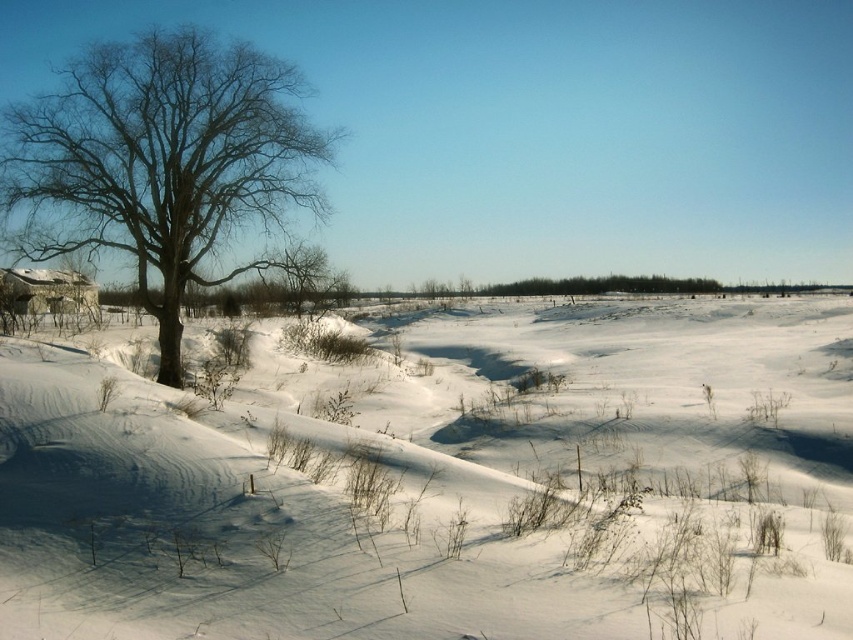
You are an observer looking at the winter landscape. You notice the white fluffy snow at center and the bare branches at left. Which of these two objects is positioned more to the east if the sun is setting in the west and casting shadows towards the east?

The bare branches at left cast shadows towards the east because the sun is setting in the west. Since the white fluffy snow at center is to the right of the bare branches at left, its shadow would also extend towards the east. However, the position relative to east would depend on their placement in the frame. But according to the description, the white fluffy snow at center is to the right of the bare branches at left, meaning the snow is further east than the branches. Therefore, the white fluffy snow at.

From the picture: You are a hiker trying to cross the snow field in the image. You see the white fluffy snow at center and the bare branches at left. How far apart are these two landmarks?

The white fluffy snow at center and the bare branches at left are 15.54 meters apart.